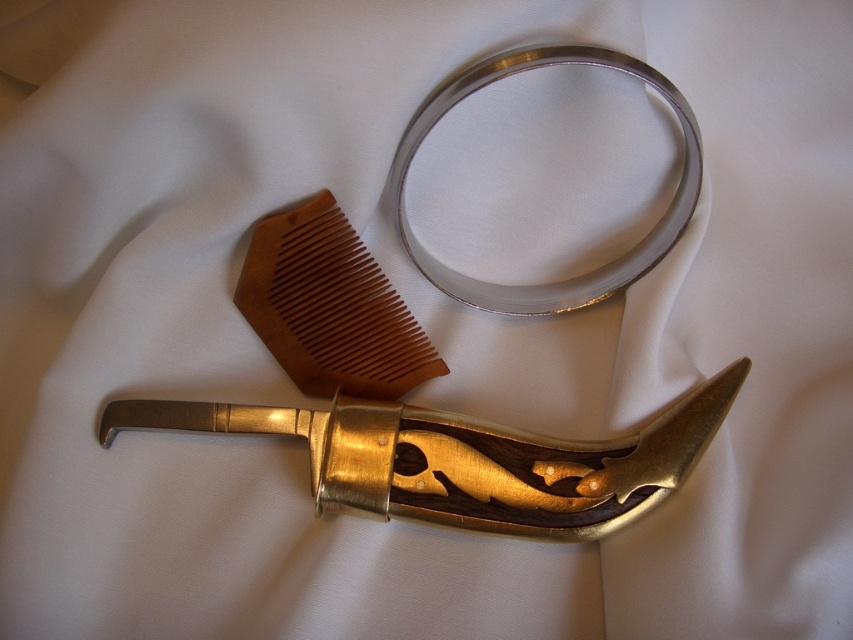
Question: Does brown wood comb at center-left appear on the right side of silver metallic ring at upper center?

Choices:
 (A) no
 (B) yes

Answer: (A)

Question: Does brown wood comb at center-left appear over silver metallic ring at upper center?

Choices:
 (A) yes
 (B) no

Answer: (B)

Question: Considering the real-world distances, which object is farthest from the gold polished metal sword at lower center?

Choices:
 (A) silver metallic ring at upper center
 (B) brown wood comb at center-left

Answer: (A)

Question: Which of the following is the closest to the observer?

Choices:
 (A) (347, 336)
 (B) (399, 228)
 (C) (469, 476)

Answer: (C)

Question: Is gold polished metal sword at lower center positioned behind brown wood comb at center-left?

Choices:
 (A) yes
 (B) no

Answer: (B)

Question: Which of the following is the closest to the observer?

Choices:
 (A) gold polished metal sword at lower center
 (B) brown wood comb at center-left
 (C) silver metallic ring at upper center

Answer: (C)